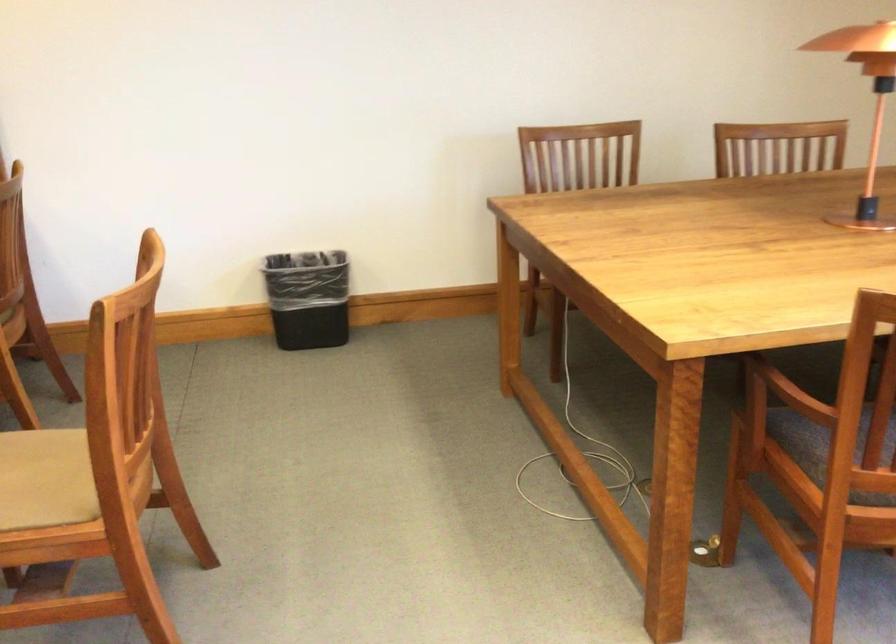
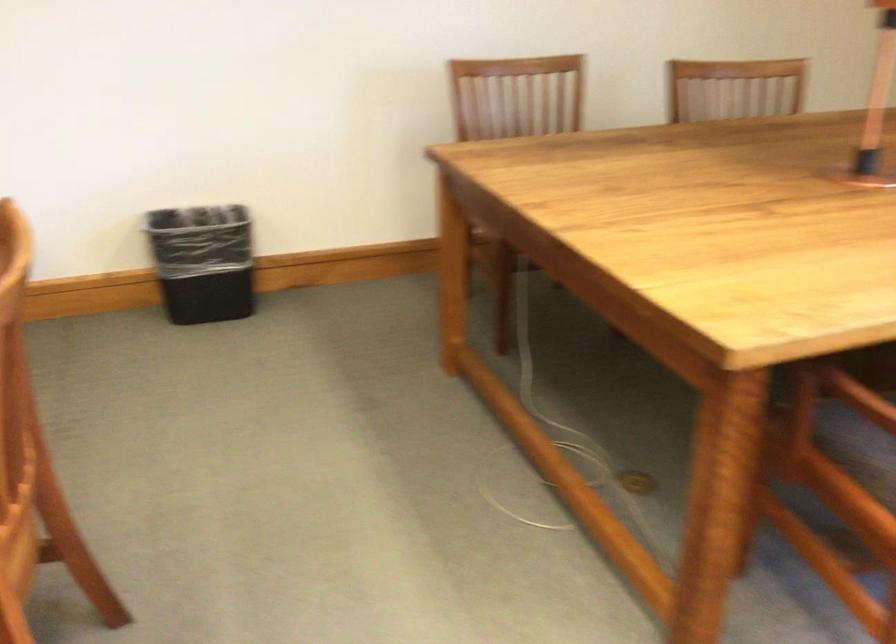
Question: The images are taken continuously from a first-person perspective. In which direction is your viewpoint rotating?

Choices:
 (A) Left
 (B) Right
 (C) Up
 (D) Down

Answer: (B)